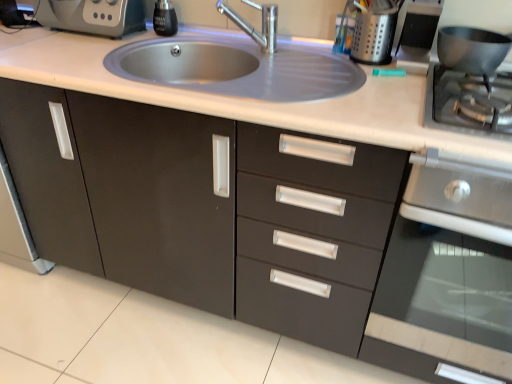
Question: Should I look upward or downward to see black glass soap dispenser at upper center?

Choices:
 (A) up
 (B) down

Answer: (A)

Question: Is polished chrome faucet at upper center not within teal plastic marker at upper right, placed as the second appliance when sorted from left to right?

Choices:
 (A) no
 (B) yes

Answer: (B)

Question: Is polished chrome faucet at upper center not close to teal plastic marker at upper right, placed as the second appliance when sorted from left to right?

Choices:
 (A) yes
 (B) no

Answer: (B)

Question: Considering the relative sizes of polished chrome faucet at upper center and teal plastic marker at upper right, the second appliance in the right-to-left sequence, in the image provided, is polished chrome faucet at upper center wider than teal plastic marker at upper right, the second appliance in the right-to-left sequence,?

Choices:
 (A) no
 (B) yes

Answer: (B)

Question: From a real-world perspective, is polished chrome faucet at upper center beneath teal plastic marker at upper right, the second appliance in the right-to-left sequence?

Choices:
 (A) no
 (B) yes

Answer: (B)

Question: Is polished chrome faucet at upper center in front of teal plastic marker at upper right, placed as the second appliance when sorted from left to right?

Choices:
 (A) yes
 (B) no

Answer: (B)

Question: Does polished chrome faucet at upper center have a larger size compared to teal plastic marker at upper right, the second appliance in the right-to-left sequence?

Choices:
 (A) yes
 (B) no

Answer: (B)

Question: Considering the relative positions of stainless steel oven at right and stainless steel gas stove at right in the image provided, is stainless steel oven at right in front of stainless steel gas stove at right?

Choices:
 (A) no
 (B) yes

Answer: (B)

Question: Is stainless steel oven at right aimed at stainless steel gas stove at right?

Choices:
 (A) yes
 (B) no

Answer: (B)

Question: Considering the relative sizes of stainless steel oven at right and stainless steel gas stove at right in the image provided, is stainless steel oven at right bigger than stainless steel gas stove at right?

Choices:
 (A) yes
 (B) no

Answer: (A)

Question: Is stainless steel oven at right at the right side of stainless steel gas stove at right?

Choices:
 (A) yes
 (B) no

Answer: (A)

Question: From the image's perspective, would you say stainless steel oven at right is shown under stainless steel gas stove at right?

Choices:
 (A) no
 (B) yes

Answer: (B)

Question: Is the depth of stainless steel oven at right greater than that of stainless steel gas stove at right?

Choices:
 (A) yes
 (B) no

Answer: (B)

Question: Can you confirm if black glass soap dispenser at upper center is smaller than satin steel sink at center?

Choices:
 (A) yes
 (B) no

Answer: (A)